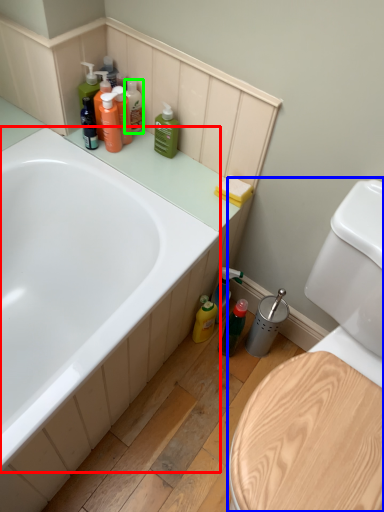
Question: Based on their relative distances, which object is farther from bathtub (highlighted by a red box)? Choose from toilet (highlighted by a blue box) and toiletry (highlighted by a green box).

Choices:
 (A) toilet
 (B) toiletry

Answer: (A)